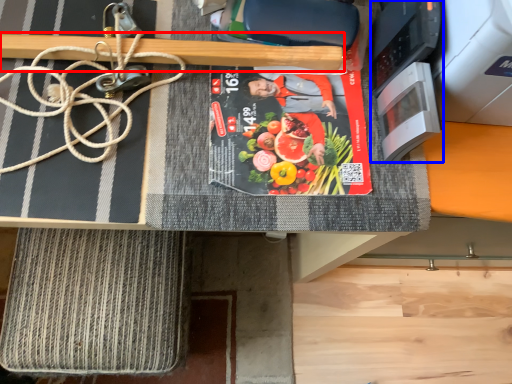
Question: Which object is closer to the camera taking this photo, wood (highlighted by a red box) or appliance (highlighted by a blue box)?

Choices:
 (A) wood
 (B) appliance

Answer: (B)